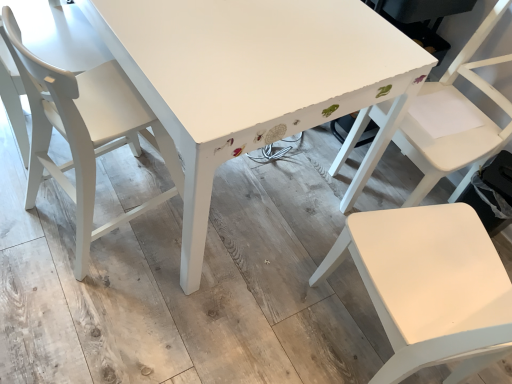
Locate an element on the screen. The width and height of the screenshot is (512, 384). free space in front of matte white chair at left, positioned as the third chair in right-to-left order is located at coordinates (83, 306).